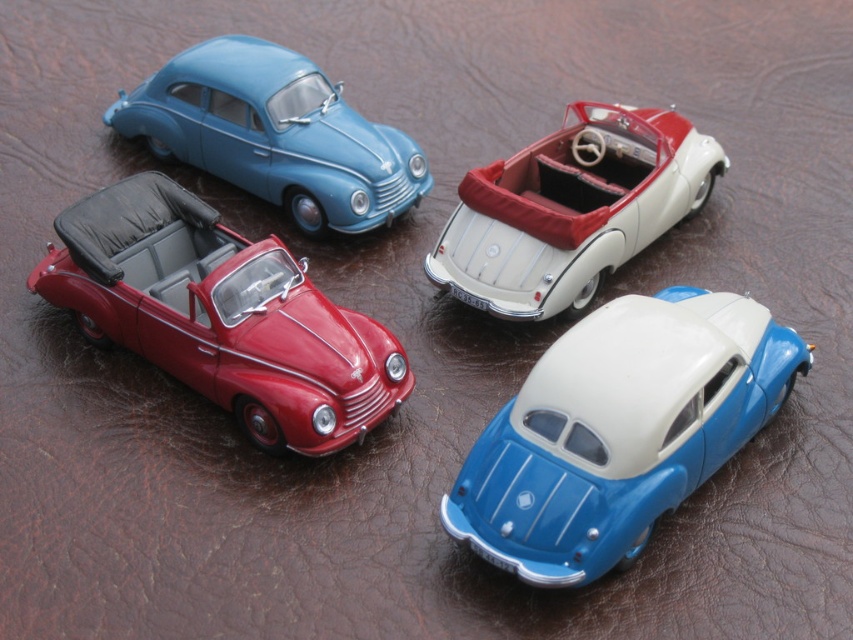
Question: Can you confirm if blue glossy toy car at lower right is thinner than white matte convertible at upper center?

Choices:
 (A) no
 (B) yes

Answer: (A)

Question: Which point appears farthest from the camera in this image?

Choices:
 (A) (x=686, y=401)
 (B) (x=236, y=358)
 (C) (x=186, y=93)

Answer: (C)

Question: Which of the following is the farthest from the observer?

Choices:
 (A) (270, 252)
 (B) (722, 173)

Answer: (B)

Question: Where is blue glossy toy car at lower right located in relation to matte blue car at upper left in the image?

Choices:
 (A) above
 (B) below

Answer: (B)

Question: Does white matte convertible at upper center have a smaller size compared to matte blue car at upper left?

Choices:
 (A) yes
 (B) no

Answer: (A)

Question: Which object appears farthest from the camera in this image?

Choices:
 (A) matte blue car at upper left
 (B) shiny red convertible at upper left
 (C) white matte convertible at upper center

Answer: (A)